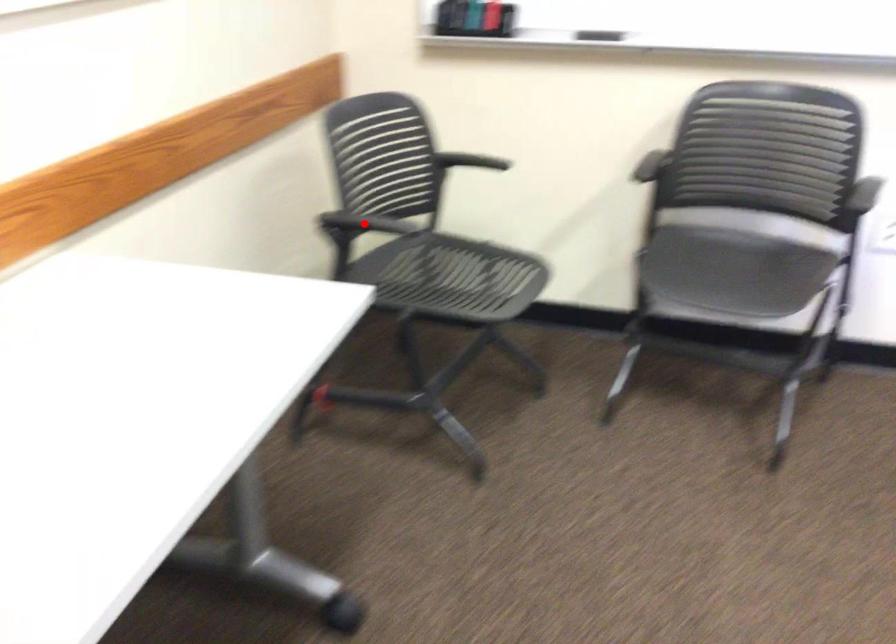
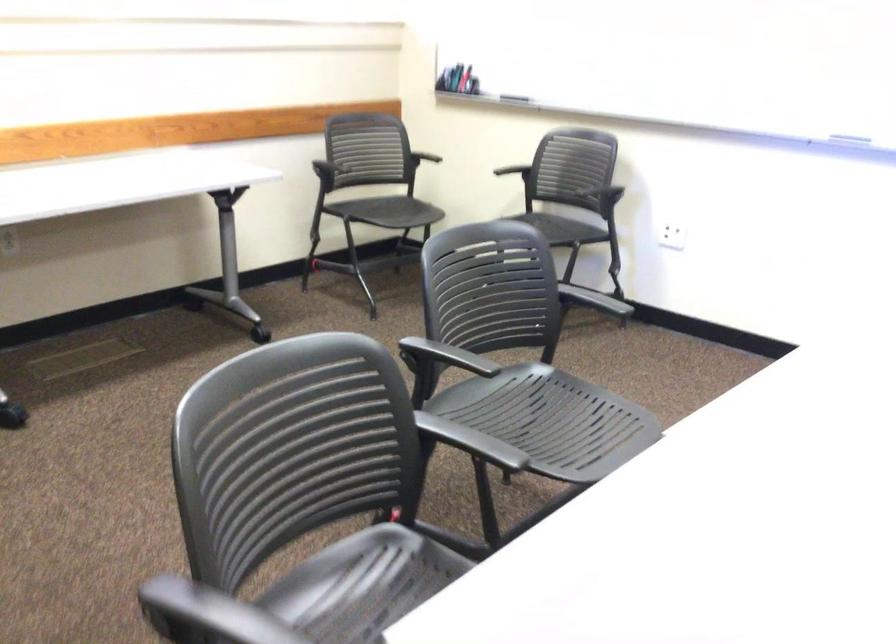
Question: I am providing you with two images of the same scene from different viewpoints. In image1, a red point is highlighted. Considering the same 3D point in image2, which of the following is correct?

Choices:
 (A) It is closer
 (B) It is farther

Answer: (B)